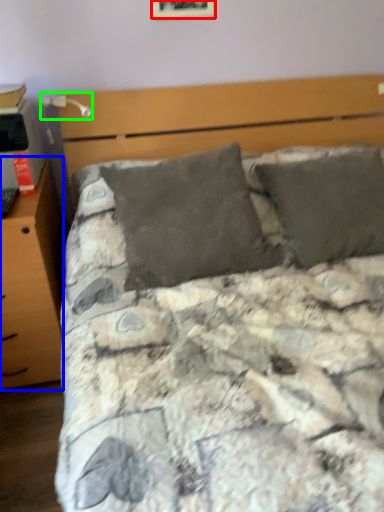
Question: Considering the real-world distances, which object is closest to picture frame (highlighted by a red box)? nightstand (highlighted by a blue box) or table lamp (highlighted by a green box).

Choices:
 (A) nightstand
 (B) table lamp

Answer: (B)